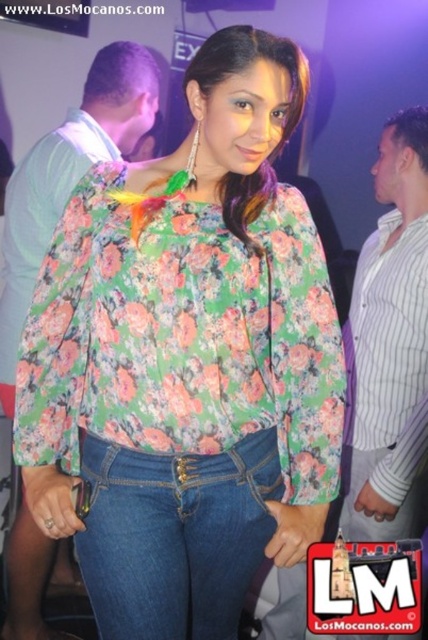
You are a photographer at the party and want to capture both the striped cotton shirt at right and the floral fabric shirt at upper left in a single frame. Which shirt should you focus on to ensure both are visible without cropping?

The striped cotton shirt at right occupies less space than the floral fabric shirt at upper left, so focusing on the floral fabric shirt at upper left would allow both to be visible as the larger shirt provides more room for the smaller one in the frame.

Based on the coordinates provided in the scene description, where is the denim jeans at center positioned?

The denim jeans at center is positioned at point 0.839 on the x axis and 0.409 on the y axis.

What are the coordinates of the denim jeans at center?

The denim jeans at center is located at point (175,536).